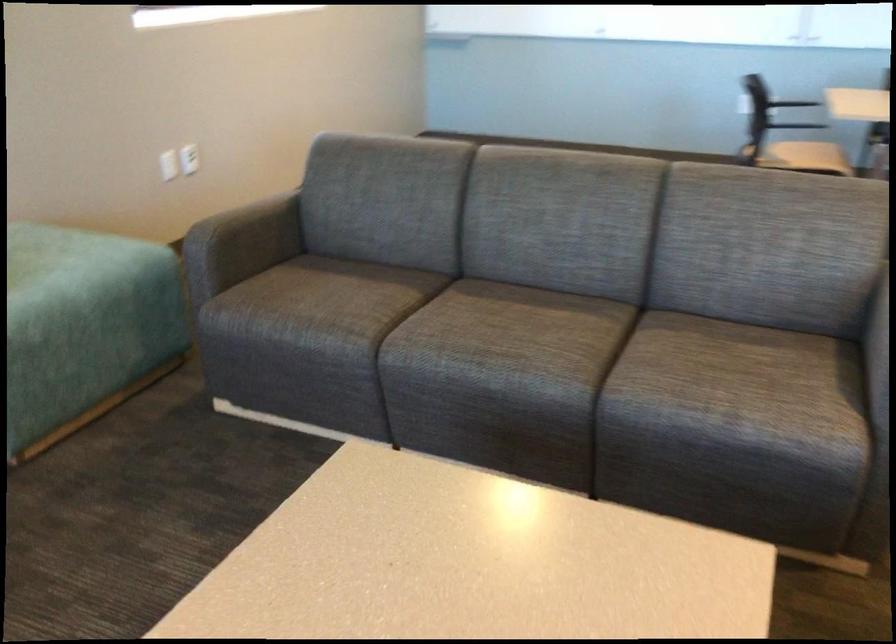
You are a GUI agent. You are given a task and a screenshot of the screen. Output one action in this format:
    pyautogui.click(x=<x>, y=<y>)
    Task: Click on the chair sitting surface
    
    Given the screenshot: What is the action you would take?
    pyautogui.click(x=813, y=155)